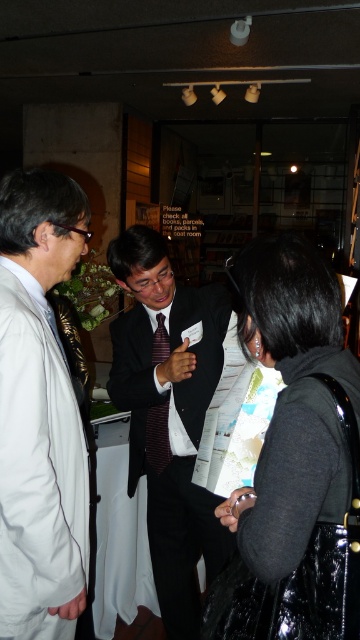
You are a photographer trying to capture a clear photo of the matte black suit at center without the black shiny jacket at lower right blocking it. Can you adjust your position to do so?

The black shiny jacket at lower right is positioned over the matte black suit at center, so adjusting your position to angle the camera downward might help avoid the obstruction.